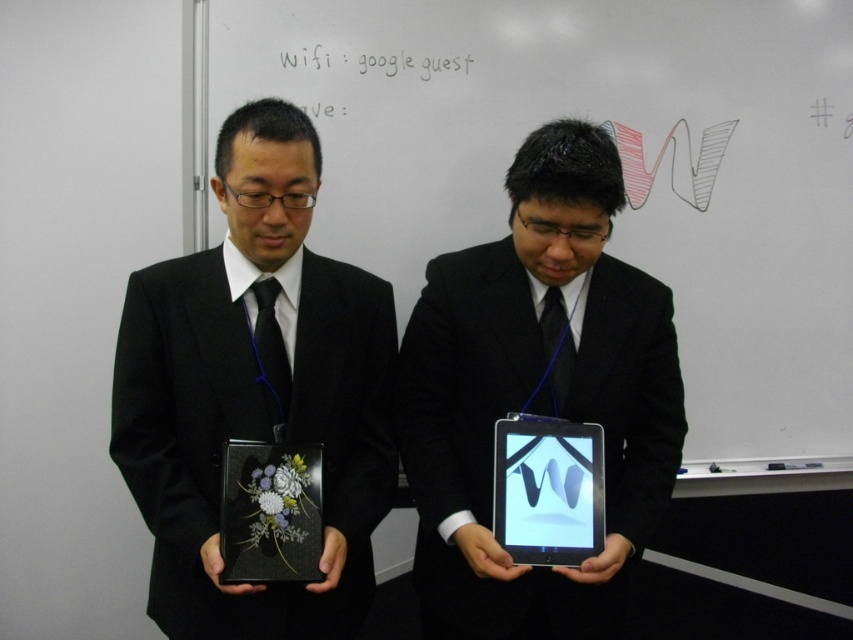
Does matte black box at center appear over shiny black tablet at center?

Indeed, matte black box at center is positioned over shiny black tablet at center.

Based on the photo, which is more to the left, matte black box at center or shiny black tablet at center?

From the viewer's perspective, matte black box at center appears more on the left side.

Is point (263, 612) farther from viewer compared to point (604, 566)?

Yes, it is.

Where is `matte black box at center`? The width and height of the screenshot is (853, 640). matte black box at center is located at coordinates (256, 390).

Between matte black tablet at center and black glossy plaque at center, which one appears on the left side from the viewer's perspective?

From the viewer's perspective, black glossy plaque at center appears more on the left side.

Can you confirm if matte black tablet at center is positioned to the left of black glossy plaque at center?

No, matte black tablet at center is not to the left of black glossy plaque at center.

Is point (531, 476) closer to viewer compared to point (222, 484)?

No.

Locate an element on the screen. matte black tablet at center is located at coordinates (548, 490).

Who is positioned more to the right, matte black box at center or matte black tablet at center?

matte black tablet at center is more to the right.

Between matte black box at center and matte black tablet at center, which one has more height?

matte black box at center

Does point (291, 224) lie behind point (604, 518)?

That is False.

Locate an element on the screen. The width and height of the screenshot is (853, 640). matte black box at center is located at coordinates (256, 390).